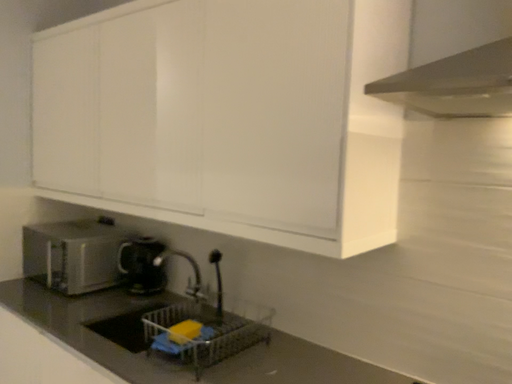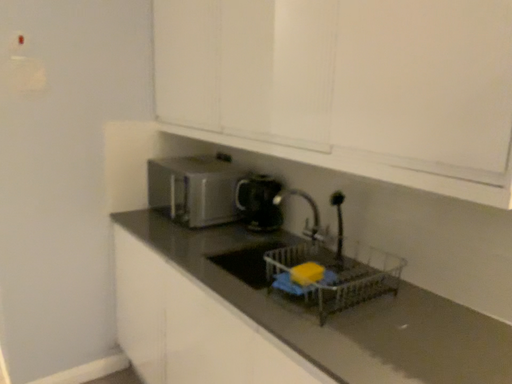
Question: Which way did the camera rotate in the video?

Choices:
 (A) rotated downward
 (B) rotated upward

Answer: (A)